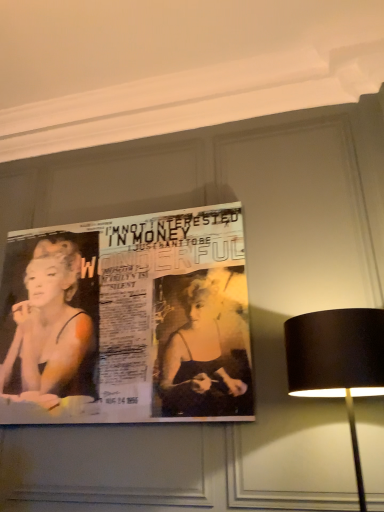
Question: From the image's perspective, is black fabric lampshade at right above matte paper poster at upper center?

Choices:
 (A) no
 (B) yes

Answer: (A)

Question: From the image's perspective, is black fabric lampshade at right located beneath matte paper poster at upper center?

Choices:
 (A) no
 (B) yes

Answer: (B)

Question: Is black fabric lampshade at right beside matte paper poster at upper center?

Choices:
 (A) yes
 (B) no

Answer: (B)

Question: Is matte paper poster at upper center completely or partially inside black fabric lampshade at right?

Choices:
 (A) yes
 (B) no

Answer: (B)

Question: Is black fabric lampshade at right positioned with its back to matte paper poster at upper center?

Choices:
 (A) yes
 (B) no

Answer: (B)

Question: Can you confirm if black fabric lampshade at right is smaller than matte paper poster at upper center?

Choices:
 (A) yes
 (B) no

Answer: (B)

Question: Would you say matte paper poster at upper center is outside black fabric lampshade at right?

Choices:
 (A) no
 (B) yes

Answer: (B)

Question: From a real-world perspective, is matte paper poster at upper center below black fabric lampshade at right?

Choices:
 (A) no
 (B) yes

Answer: (A)

Question: Does matte paper poster at upper center have a lesser height compared to black fabric lampshade at right?

Choices:
 (A) no
 (B) yes

Answer: (A)

Question: Is matte paper poster at upper center taller than black fabric lampshade at right?

Choices:
 (A) yes
 (B) no

Answer: (A)

Question: Does matte paper poster at upper center have a greater width compared to black fabric lampshade at right?

Choices:
 (A) no
 (B) yes

Answer: (A)

Question: Considering the relative sizes of matte paper poster at upper center and black fabric lampshade at right in the image provided, is matte paper poster at upper center smaller than black fabric lampshade at right?

Choices:
 (A) no
 (B) yes

Answer: (B)

Question: In terms of width, does black fabric lampshade at right look wider or thinner when compared to matte paper poster at upper center?

Choices:
 (A) wide
 (B) thin

Answer: (A)